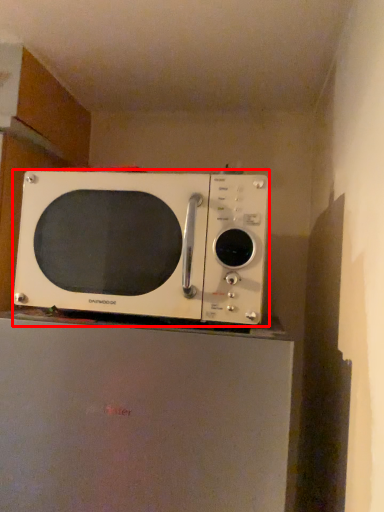
Question: Where is microwave oven (annotated by the red box) located in relation to appliance in the image?

Choices:
 (A) right
 (B) left

Answer: (A)